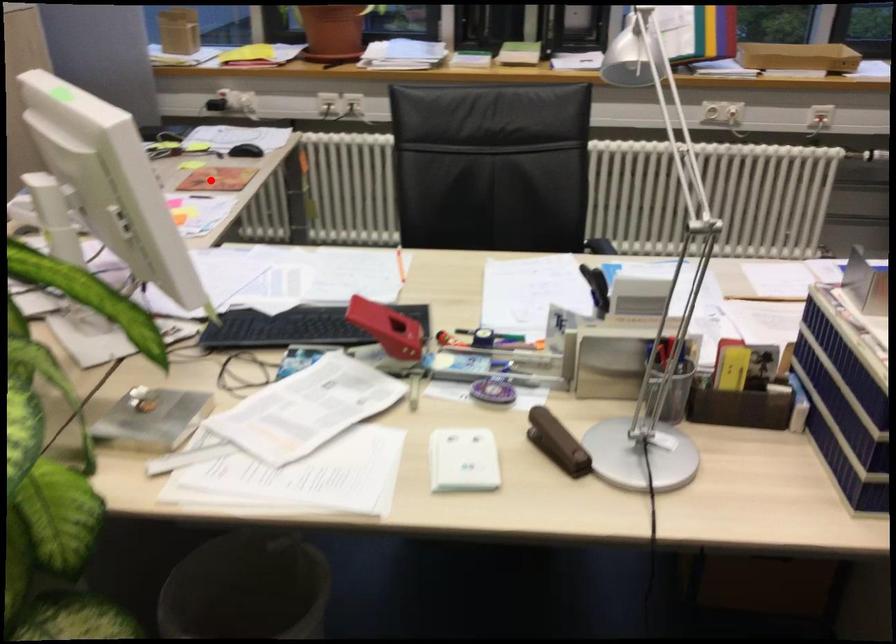
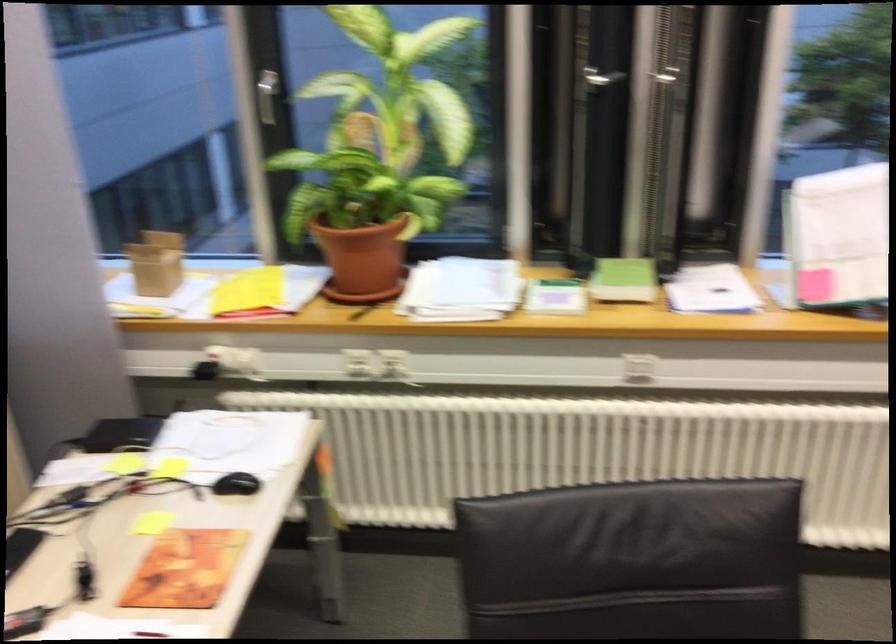
Locate, in the second image, the point that corresponds to the highlighted location in the first image.

(185, 569)